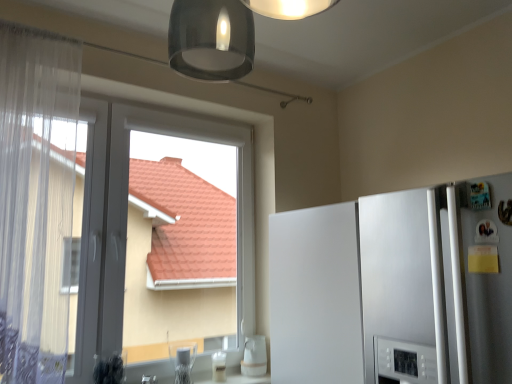
Image resolution: width=512 pixels, height=384 pixels. What do you see at coordinates (36, 200) in the screenshot?
I see `white sheer curtain at left` at bounding box center [36, 200].

Looking at this image, in order to face transparent plastic window at left, should I rotate leftwards or rightwards?

It's best to rotate left around 13.457 degrees.

Find the location of `clear glass at lower center, acting as the 1th appliance starting from the right`. clear glass at lower center, acting as the 1th appliance starting from the right is located at coordinates (219, 366).

Would you say white glossy refrigerator at right is part of transparent plastic window at left's contents?

No, white glossy refrigerator at right is not a part of transparent plastic window at left.

From a real-world perspective, between transparent plastic window at left and white glossy refrigerator at right, who is vertically higher?

From a 3D spatial view, transparent plastic window at left is above.

Is transparent plastic window at left in front of white glossy refrigerator at right?

No, it is behind white glossy refrigerator at right.

At what (x,y) coordinates should I click in order to perform the action: click on window on the left side of clear glass at lower center, which is counted as the 2th appliance, starting from the left. Please return your answer as a coordinate pair (x, y). This screenshot has height=384, width=512. Looking at the image, I should click on point(127,217).

Which is less distant, (225, 354) or (244, 242)?

Clearly, point (225, 354) is closer to the camera than point (244, 242).

Can you confirm if clear glass at lower center, acting as the 1th appliance starting from the right, is shorter than transparent plastic window at left?

Indeed, clear glass at lower center, acting as the 1th appliance starting from the right, has a lesser height compared to transparent plastic window at left.

Is clear glass at lower center, acting as the 1th appliance starting from the right, positioned beyond the bounds of transparent plastic window at left?

No, clear glass at lower center, acting as the 1th appliance starting from the right, is inside or overlapping with transparent plastic window at left.

Is white glossy cup at lower center, arranged as the first appliance when viewed from the left, surrounded by transparent plastic window at left?

Yes, white glossy cup at lower center, arranged as the first appliance when viewed from the left, is a part of transparent plastic window at left.

What's the angular difference between transparent plastic window at left and white glossy cup at lower center, arranged as the first appliance when viewed from the left,'s facing directions?

The angular difference between transparent plastic window at left and white glossy cup at lower center, arranged as the first appliance when viewed from the left, is 5.09 degrees.

Is transparent plastic window at left positioned before white glossy cup at lower center, arranged as the first appliance when viewed from the left?

Yes, transparent plastic window at left is in front of white glossy cup at lower center, arranged as the first appliance when viewed from the left.

This screenshot has height=384, width=512. Find the location of `the 1st appliance counting from the right side of the transparent plastic window at left`. the 1st appliance counting from the right side of the transparent plastic window at left is located at coordinates (183, 360).

Can you see white glossy cup at lower center, the 2th appliance when ordered from right to left, touching clear glass at lower center, acting as the 1th appliance starting from the right?

No, white glossy cup at lower center, the 2th appliance when ordered from right to left, is not with clear glass at lower center, acting as the 1th appliance starting from the right.

From the picture: Considering the relative sizes of white glossy cup at lower center, the 2th appliance when ordered from right to left, and clear glass at lower center, acting as the 1th appliance starting from the right, in the image provided, is white glossy cup at lower center, the 2th appliance when ordered from right to left, smaller than clear glass at lower center, acting as the 1th appliance starting from the right,?

No, white glossy cup at lower center, the 2th appliance when ordered from right to left, is not smaller than clear glass at lower center, acting as the 1th appliance starting from the right.

Is white glossy cup at lower center, the 2th appliance when ordered from right to left, thinner than clear glass at lower center, acting as the 1th appliance starting from the right?

In fact, white glossy cup at lower center, the 2th appliance when ordered from right to left, might be wider than clear glass at lower center, acting as the 1th appliance starting from the right.

Starting from the white sheer curtain at left, which appliance is the 2nd one to the right? Please provide its 2D coordinates.

[(219, 366)]

Is clear glass at lower center, which is counted as the 2th appliance, starting from the left, completely or partially inside white sheer curtain at left?

No.

Which object is wider, white sheer curtain at left or clear glass at lower center, which is counted as the 2th appliance, starting from the left?

white sheer curtain at left.

Looking at this image, from a real-world perspective, is white sheer curtain at left on clear glass at lower center, acting as the 1th appliance starting from the right?

Yes, from a real-world perspective, white sheer curtain at left is over clear glass at lower center, acting as the 1th appliance starting from the right

Is point (406, 344) closer to viewer compared to point (247, 171)?

Yes, point (406, 344) is in front of point (247, 171).

Is white glossy refrigerator at right positioned behind transparent plastic window at left?

No.

Could you tell me if white glossy refrigerator at right is turned towards transparent plastic window at left?

No, white glossy refrigerator at right is not aimed at transparent plastic window at left.

Can you confirm if white glossy refrigerator at right is taller than transparent plastic window at left?

Incorrect, the height of white glossy refrigerator at right is not larger of that of transparent plastic window at left.

Does point (320, 281) come closer to viewer compared to point (217, 365)?

Yes, it is in front of point (217, 365).

Considering the relative sizes of white glossy refrigerator at right and clear glass at lower center, which is counted as the 2th appliance, starting from the left, in the image provided, is white glossy refrigerator at right bigger than clear glass at lower center, which is counted as the 2th appliance, starting from the left,?

Yes.

Is white glossy refrigerator at right not close to clear glass at lower center, acting as the 1th appliance starting from the right?

No, there isn't a large distance between white glossy refrigerator at right and clear glass at lower center, acting as the 1th appliance starting from the right.

Could you tell me if white glossy refrigerator at right is facing clear glass at lower center, which is counted as the 2th appliance, starting from the left?

No, white glossy refrigerator at right is not turned towards clear glass at lower center, which is counted as the 2th appliance, starting from the left.

This screenshot has width=512, height=384. Find the location of `window located above the white glossy refrigerator at right (from the image's perspective)`. window located above the white glossy refrigerator at right (from the image's perspective) is located at coordinates 127,217.

The height and width of the screenshot is (384, 512). I want to click on window in front of the clear glass at lower center, which is counted as the 2th appliance, starting from the left, so click(127, 217).

Estimate the real-world distances between objects in this image. Which object is closer to clear glass at lower center, which is counted as the 2th appliance, starting from the left, white glossy cup at lower center, the 2th appliance when ordered from right to left, or white glossy refrigerator at right?

white glossy cup at lower center, the 2th appliance when ordered from right to left.

Considering their positions, is white glossy refrigerator at right positioned further to white sheer curtain at left than transparent plastic window at left?

white glossy refrigerator at right is positioned further to the anchor white sheer curtain at left.

Based on their spatial positions, is clear glass at lower center, which is counted as the 2th appliance, starting from the left, or white glossy cup at lower center, the 2th appliance when ordered from right to left, closer to white glossy refrigerator at right?

clear glass at lower center, which is counted as the 2th appliance, starting from the left, lies closer to white glossy refrigerator at right than the other object.

When comparing their distances from transparent plastic window at left, does white glossy cup at lower center, arranged as the first appliance when viewed from the left, or clear glass at lower center, acting as the 1th appliance starting from the right, seem closer?

clear glass at lower center, acting as the 1th appliance starting from the right, lies closer to transparent plastic window at left than the other object.

Which object lies nearer to the anchor point clear glass at lower center, which is counted as the 2th appliance, starting from the left, white sheer curtain at left or white glossy cup at lower center, arranged as the first appliance when viewed from the left?

white glossy cup at lower center, arranged as the first appliance when viewed from the left, is closer to clear glass at lower center, which is counted as the 2th appliance, starting from the left.

When comparing their distances from white glossy refrigerator at right, does white sheer curtain at left or white glossy cup at lower center, arranged as the first appliance when viewed from the left, seem closer?

Based on the image, white glossy cup at lower center, arranged as the first appliance when viewed from the left, appears to be nearer to white glossy refrigerator at right.

Which object lies nearer to the anchor point white glossy cup at lower center, arranged as the first appliance when viewed from the left, clear glass at lower center, which is counted as the 2th appliance, starting from the left, or white glossy refrigerator at right?

clear glass at lower center, which is counted as the 2th appliance, starting from the left, is positioned closer to the anchor white glossy cup at lower center, arranged as the first appliance when viewed from the left.

Looking at the image, which one is located closer to transparent plastic window at left, white glossy refrigerator at right or white sheer curtain at left?

white sheer curtain at left is closer to transparent plastic window at left.

What are the coordinates of `appliance between white sheer curtain at left and clear glass at lower center, acting as the 1th appliance starting from the right, from top to bottom` in the screenshot? It's located at (183, 360).

Identify the location of window between white sheer curtain at left and clear glass at lower center, which is counted as the 2th appliance, starting from the left, in the vertical direction. (127, 217).

Find the location of a particular element. window between white sheer curtain at left and white glossy cup at lower center, arranged as the first appliance when viewed from the left, in the up-down direction is located at coordinates (127, 217).

Image resolution: width=512 pixels, height=384 pixels. Identify the location of window between white sheer curtain at left and white glossy refrigerator at right in the horizontal direction. (127, 217).